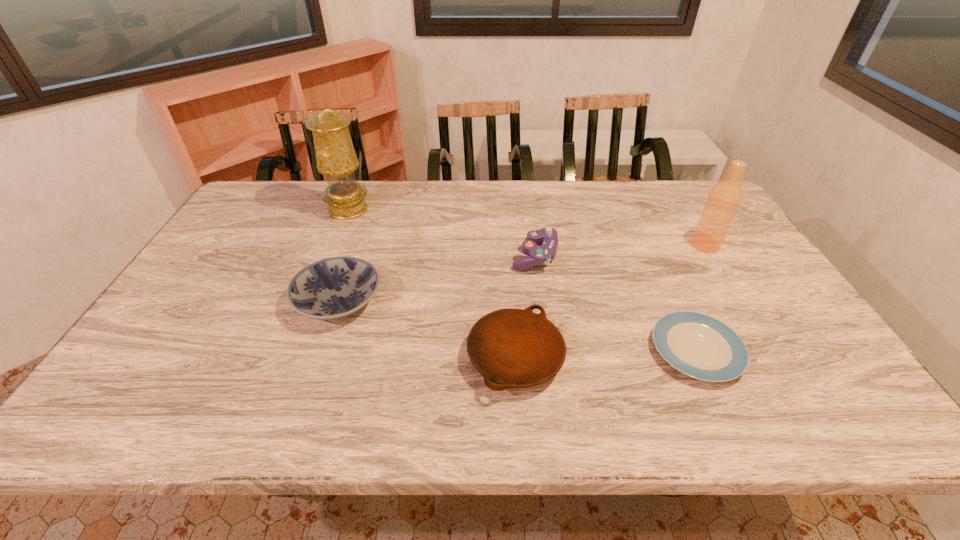
The width and height of the screenshot is (960, 540). Identify the location of vacant area between the oil lamp and the second plate from left to right. (432, 284).

Identify the location of free point between the rightmost object and the tallest object. The width and height of the screenshot is (960, 540). (527, 227).

Identify the location of unoccupied position between the beer bottle and the second plate from right to left. The image size is (960, 540). (611, 301).

Locate an element on the screen. Image resolution: width=960 pixels, height=540 pixels. the third closest object to the control is located at coordinates (332, 288).

What are the coordinates of `the fifth closest object to the leftmost plate` in the screenshot? It's located at (722, 203).

What are the coordinates of `plate that is the closest one to the shortest object` in the screenshot? It's located at (511, 348).

Identify which plate is the second nearest to the oil lamp. Please provide its 2D coordinates. Your answer should be formatted as a tuple, i.e. [(x, y)], where the tuple contains the x and y coordinates of a point satisfying the conditions above.

[(511, 348)]